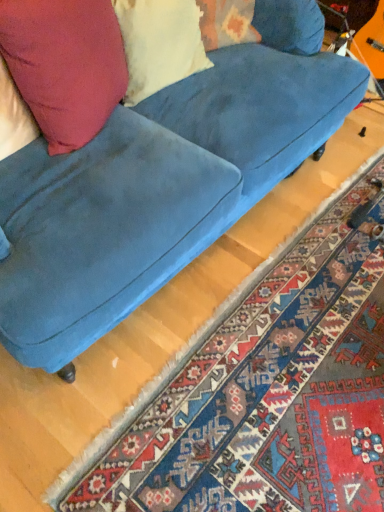
Question: From a real-world perspective, is matte pink pillow at upper left over velvet blue couch at center?

Choices:
 (A) no
 (B) yes

Answer: (B)

Question: Is matte pink pillow at upper left not close to velvet blue couch at center?

Choices:
 (A) yes
 (B) no

Answer: (B)

Question: Is matte pink pillow at upper left to the right of velvet blue couch at center from the viewer's perspective?

Choices:
 (A) yes
 (B) no

Answer: (B)

Question: Is matte pink pillow at upper left aimed at velvet blue couch at center?

Choices:
 (A) yes
 (B) no

Answer: (A)

Question: Is matte pink pillow at upper left facing away from velvet blue couch at center?

Choices:
 (A) yes
 (B) no

Answer: (A)

Question: Is matte pink pillow at upper left outside of velvet blue couch at center?

Choices:
 (A) no
 (B) yes

Answer: (A)

Question: Does carpet with intricate patterns at lower right have a larger size compared to velvet blue couch at center?

Choices:
 (A) no
 (B) yes

Answer: (A)

Question: Does carpet with intricate patterns at lower right touch velvet blue couch at center?

Choices:
 (A) no
 (B) yes

Answer: (A)

Question: From a real-world perspective, is carpet with intricate patterns at lower right below velvet blue couch at center?

Choices:
 (A) yes
 (B) no

Answer: (A)

Question: Considering the relative positions of carpet with intricate patterns at lower right and velvet blue couch at center in the image provided, is carpet with intricate patterns at lower right behind velvet blue couch at center?

Choices:
 (A) no
 (B) yes

Answer: (B)

Question: Considering the relative sizes of carpet with intricate patterns at lower right and velvet blue couch at center in the image provided, is carpet with intricate patterns at lower right smaller than velvet blue couch at center?

Choices:
 (A) yes
 (B) no

Answer: (A)

Question: Would you say carpet with intricate patterns at lower right is a long distance from velvet blue couch at center?

Choices:
 (A) no
 (B) yes

Answer: (A)

Question: Considering the relative sizes of carpet with intricate patterns at lower right and matte yellow pillow at upper left in the image provided, is carpet with intricate patterns at lower right wider than matte yellow pillow at upper left?

Choices:
 (A) no
 (B) yes

Answer: (B)